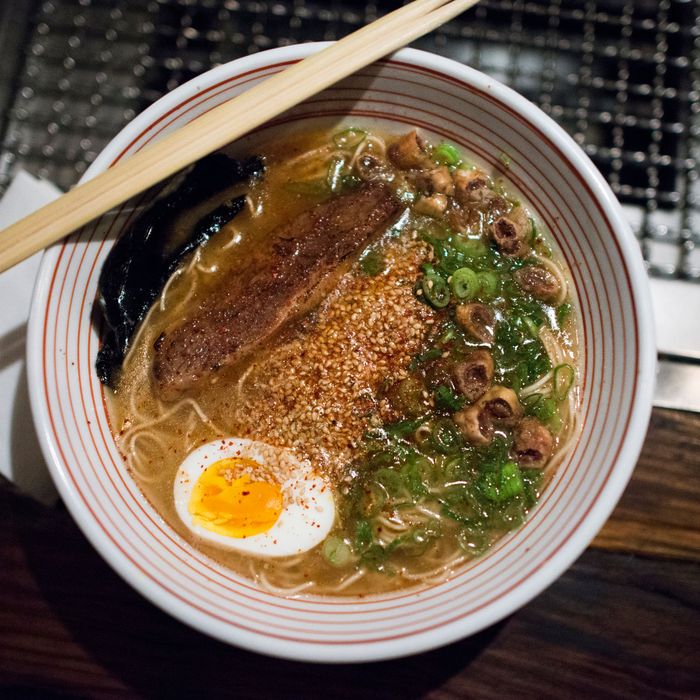
Where is `napkin`? The image size is (700, 700). napkin is located at coordinates (10, 283).